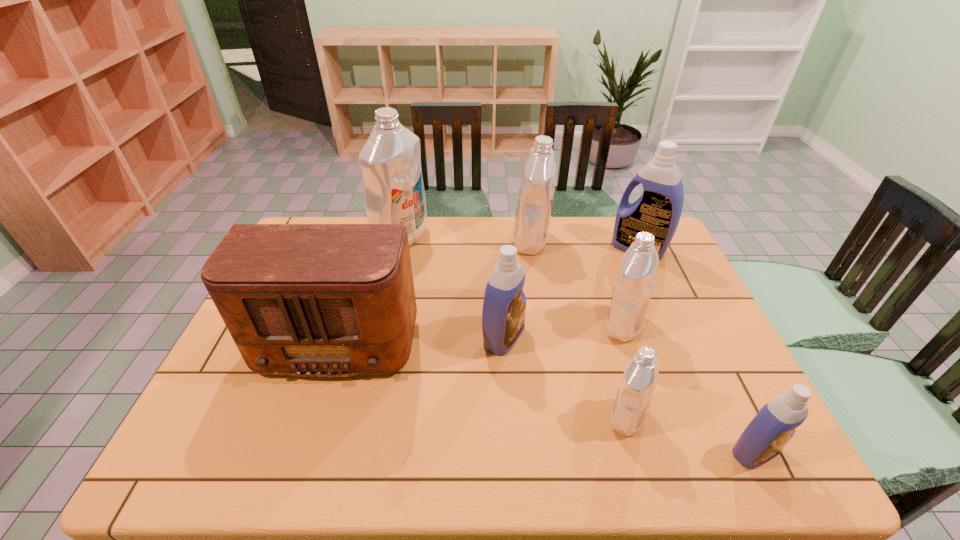
Locate an element on the screen. blue detergent that is the third closest to the radio receiver is located at coordinates (763, 439).

I want to click on vacant position in the image that satisfies the following two spatial constraints: 1. on the back side of the second white detergent from left to right; 2. on the right side of the second nearest blue detergent, so click(x=498, y=241).